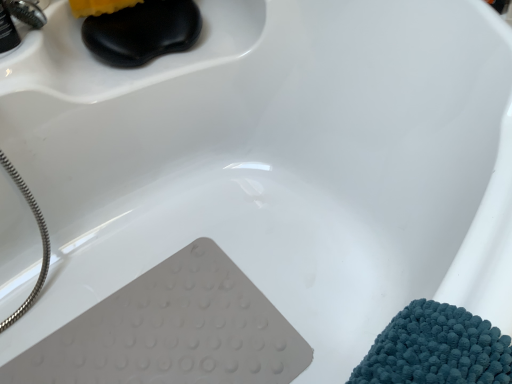
Question: From a real-world perspective, relative to brushed metal faucet at upper left, which is the 2th faucet from back to front, is brushed metal faucet at upper left, the second faucet in the front-to-back sequence, vertically above or below?

Choices:
 (A) above
 (B) below

Answer: (B)

Question: In terms of height, does brushed metal faucet at upper left, placed as the first faucet when sorted from back to front, look taller or shorter compared to brushed metal faucet at upper left, which ranks as the first faucet in front-to-back order?

Choices:
 (A) tall
 (B) short

Answer: (B)

Question: In terms of size, does brushed metal faucet at upper left, placed as the first faucet when sorted from back to front, appear bigger or smaller than brushed metal faucet at upper left, which is the 2th faucet from back to front?

Choices:
 (A) small
 (B) big

Answer: (A)

Question: Is brushed metal faucet at upper left, which is the 2th faucet from back to front, inside or outside of brushed metal faucet at upper left, the second faucet in the front-to-back sequence?

Choices:
 (A) outside
 (B) inside

Answer: (A)

Question: From the image's perspective, is brushed metal faucet at upper left, which ranks as the first faucet in front-to-back order, positioned above or below brushed metal faucet at upper left, placed as the first faucet when sorted from back to front?

Choices:
 (A) above
 (B) below

Answer: (B)

Question: In terms of width, does brushed metal faucet at upper left, which ranks as the first faucet in front-to-back order, look wider or thinner when compared to brushed metal faucet at upper left, the second faucet in the front-to-back sequence?

Choices:
 (A) wide
 (B) thin

Answer: (A)

Question: Is brushed metal faucet at upper left, which ranks as the first faucet in front-to-back order, taller or shorter than brushed metal faucet at upper left, placed as the first faucet when sorted from back to front?

Choices:
 (A) tall
 (B) short

Answer: (A)